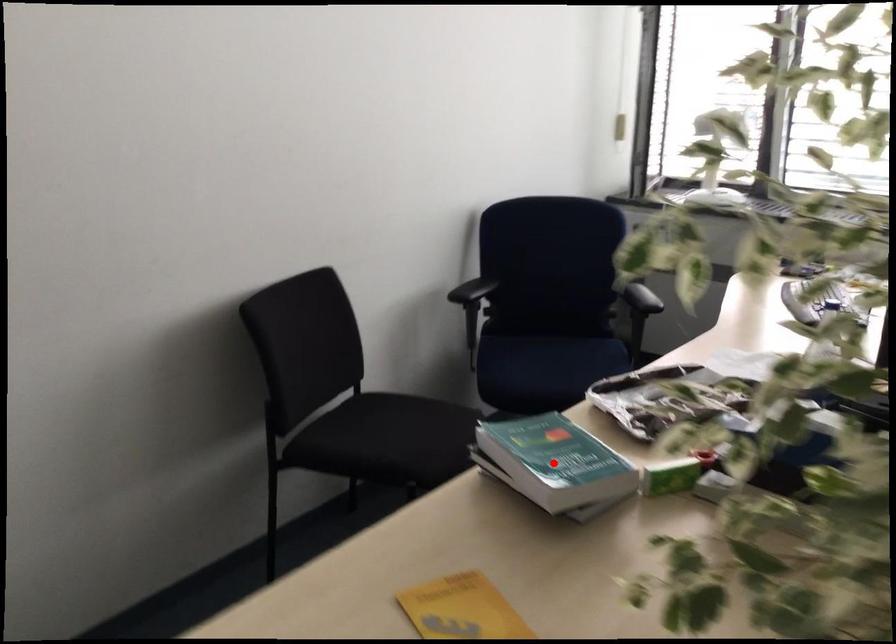
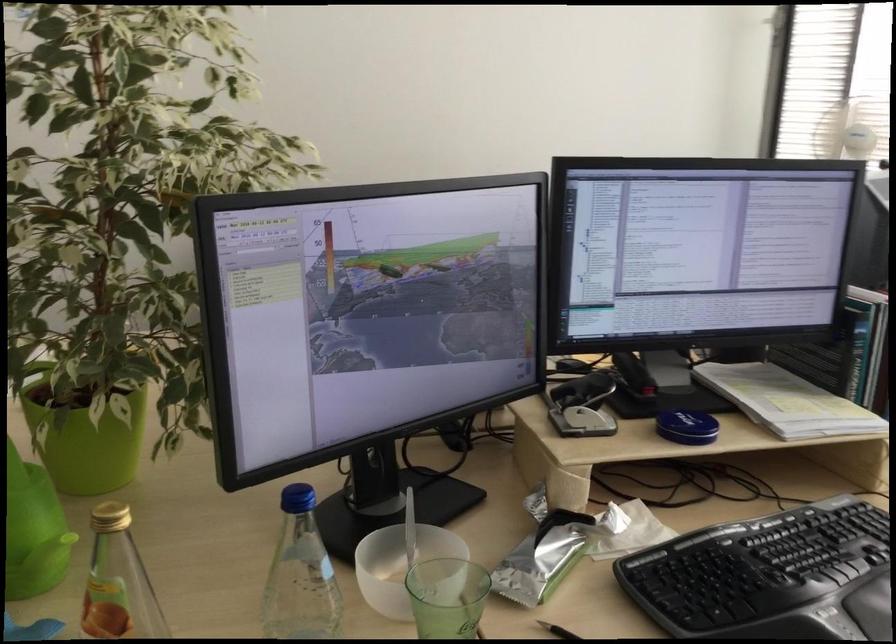
Question: I am providing you with two images of the same scene from different viewpoints. A red point is marked on the first image. At the location where the point appears in image 1, is it still visible in image 2?

Choices:
 (A) Yes
 (B) No

Answer: (B)